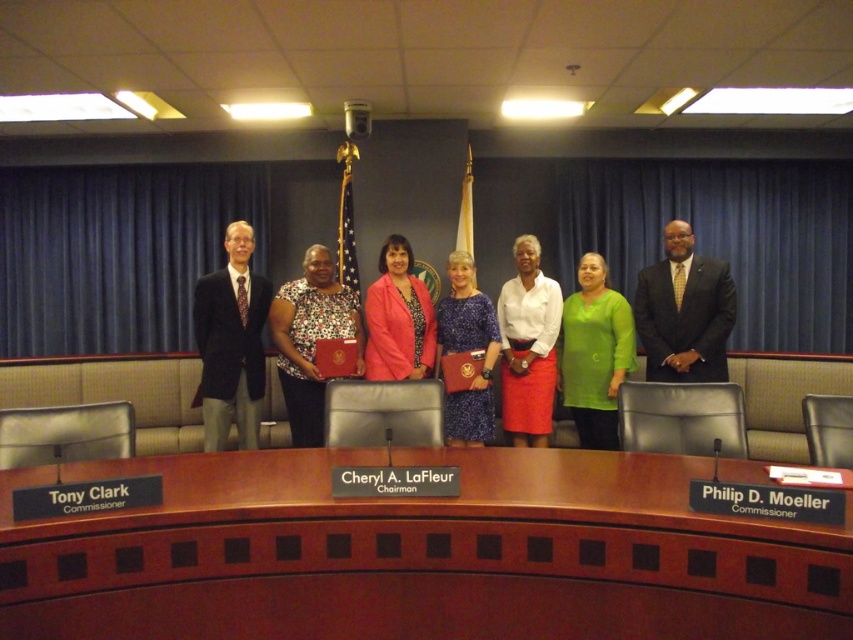
From the picture: Is dark gray suit at left positioned at the back of floral print dress at center?

No, it is not.

Describe the element at coordinates (231, 342) in the screenshot. The width and height of the screenshot is (853, 640). I see `dark gray suit at left` at that location.

The height and width of the screenshot is (640, 853). Identify the location of dark gray suit at left. (231, 342).

Can you confirm if matte black suit at center is wider than pink matte blazer at center?

Yes.

Identify the location of matte black suit at center. (683, 310).

Locate an element on the screen. The height and width of the screenshot is (640, 853). matte black suit at center is located at coordinates (683, 310).

Between brown wood table at center and pink matte blazer at center, which one is positioned higher?

pink matte blazer at center is higher up.

Can you confirm if brown wood table at center is taller than pink matte blazer at center?

No, brown wood table at center is not taller than pink matte blazer at center.

Where is `brown wood table at center`? This screenshot has width=853, height=640. brown wood table at center is located at coordinates [418, 554].